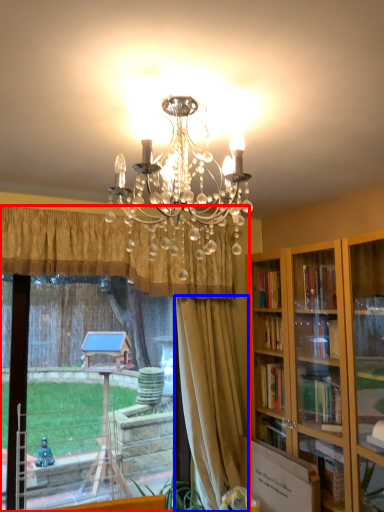
Question: Which object appears closest to the camera in this image, window (highlighted by a red box) or curtain (highlighted by a blue box)?

Choices:
 (A) window
 (B) curtain

Answer: (A)